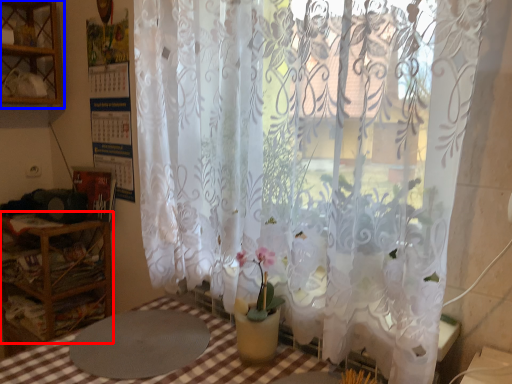
Question: Which object appears closest to the camera in this image, furniture (highlighted by a red box) or shelf (highlighted by a blue box)?

Choices:
 (A) furniture
 (B) shelf

Answer: (A)